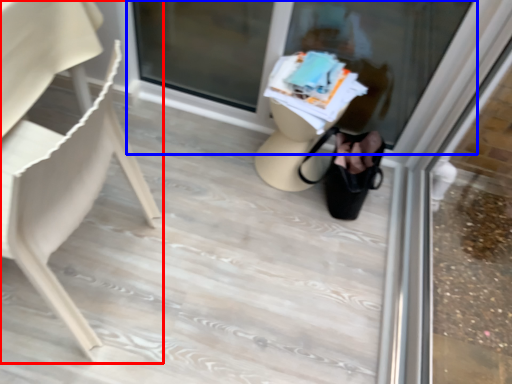
Question: Which of the following is the closest to the observer, chair (highlighted by a red box) or shop window (highlighted by a blue box)?

Choices:
 (A) chair
 (B) shop window

Answer: (A)